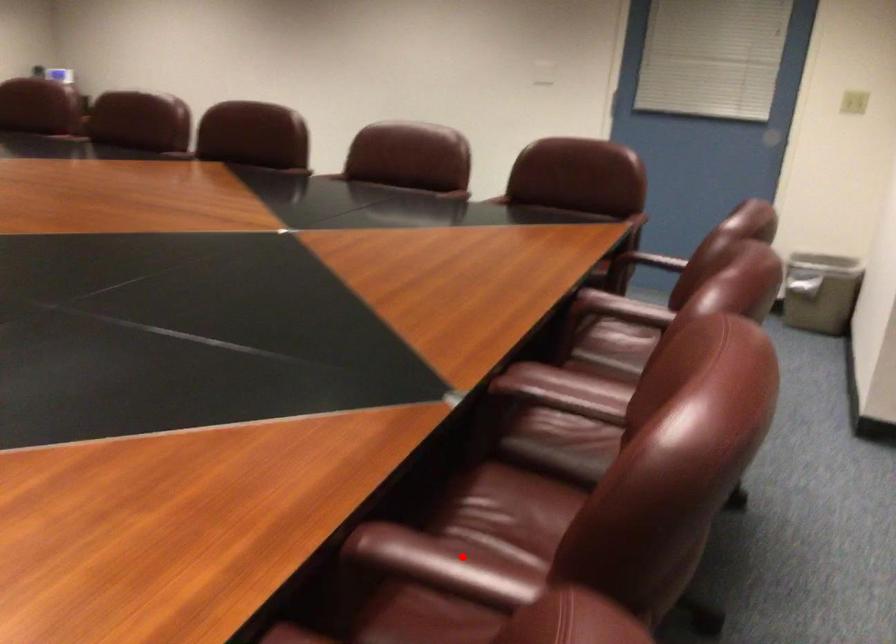
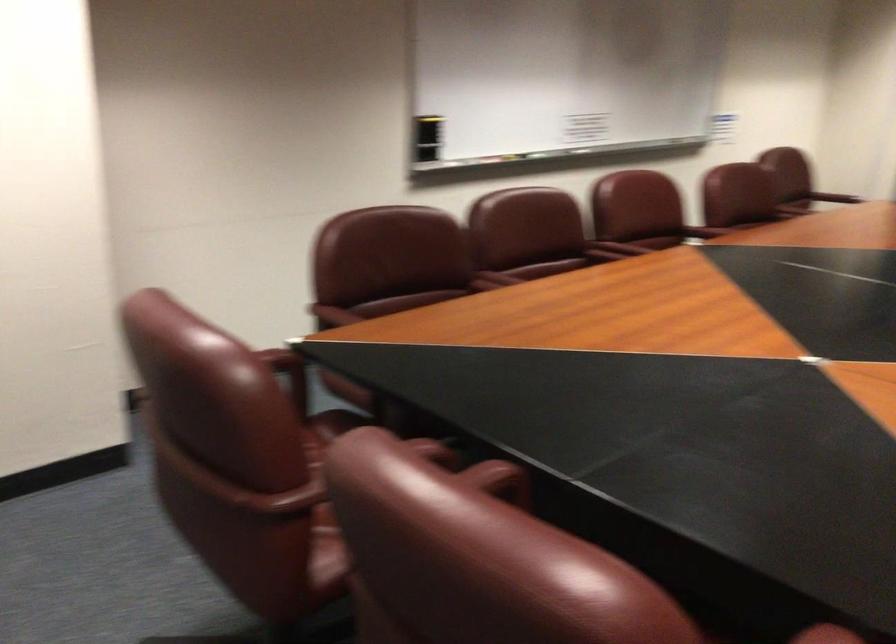
Where in the second image is the point corresponding to the highlighted location from the first image?

(703, 232)